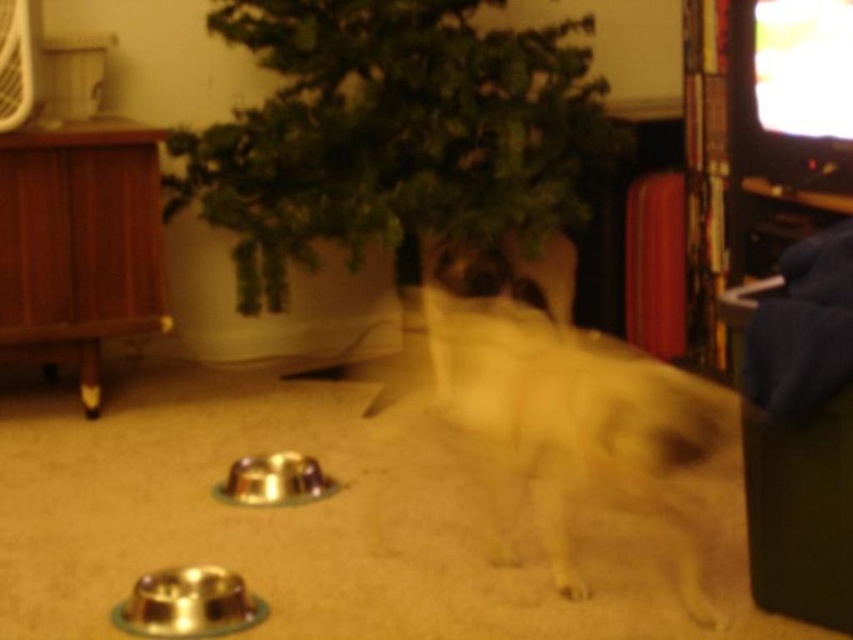
You are a delivery robot entering a living room and need to deliver a package to the white fur dog at center. The green leafy plant at center is blocking the path. Can you go around the plant to reach the dog?

The white fur dog at center is behind the green leafy plant at center, so you can go around the plant to reach the dog.

You are a pet owner who wants to place a new pet bed between the green leafy plant at center and the white fur dog at center. Given that the pet bed is 1 meter wide, will it fit between them?

The green leafy plant at center is wider than the white fur dog at center. Since the pet bed is 1 meter wide, it depends on the actual distance between them. However, the description only states the plant is wider, not the distance between them. Without knowing the exact spacing, we cannot confirm if the pet bed will fit.